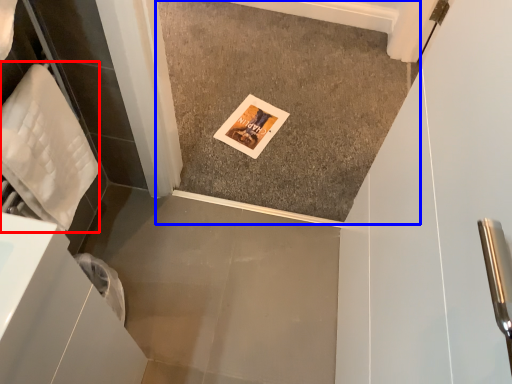
Question: Which point is further to the camera, material (highlighted by a red box) or concrete (highlighted by a blue box)?

Choices:
 (A) material
 (B) concrete

Answer: (B)